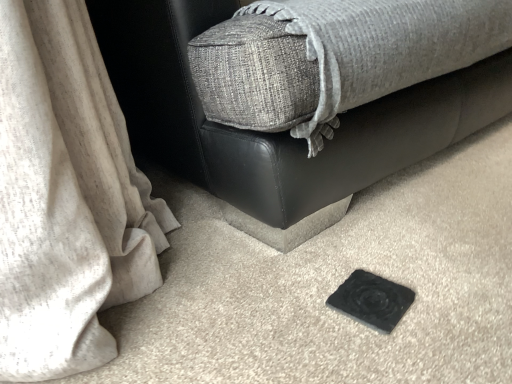
Question: From their relative heights in the image, would you say black rubber pad at lower center is taller or shorter than black matte coaster at lower center?

Choices:
 (A) short
 (B) tall

Answer: (A)

Question: From the image's perspective, is black rubber pad at lower center positioned above or below black matte coaster at lower center?

Choices:
 (A) above
 (B) below

Answer: (B)

Question: Is black rubber pad at lower center spatially inside black matte coaster at lower center, or outside of it?

Choices:
 (A) outside
 (B) inside

Answer: (A)

Question: Is black matte coaster at lower center inside the boundaries of black rubber pad at lower center, or outside?

Choices:
 (A) outside
 (B) inside

Answer: (A)

Question: Considering their positions, is black matte coaster at lower center located in front of or behind black rubber pad at lower center?

Choices:
 (A) behind
 (B) front

Answer: (B)

Question: Is black matte coaster at lower center bigger or smaller than black rubber pad at lower center?

Choices:
 (A) small
 (B) big

Answer: (B)

Question: From a real-world perspective, is black matte coaster at lower center positioned above or below black rubber pad at lower center?

Choices:
 (A) below
 (B) above

Answer: (B)